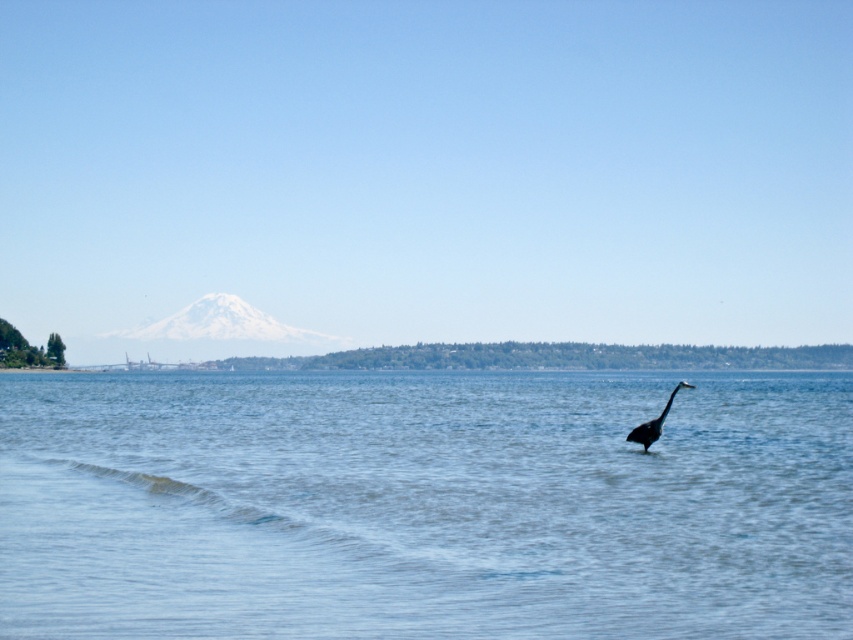
Question: Is clear blue water at center in front of gray matte bird at center?

Choices:
 (A) yes
 (B) no

Answer: (A)

Question: Can you confirm if clear blue water at center is positioned above gray matte bird at center?

Choices:
 (A) yes
 (B) no

Answer: (B)

Question: Which object appears farthest from the camera in this image?

Choices:
 (A) gray matte bird at center
 (B) clear blue water at center

Answer: (A)

Question: Which point is closer to the camera?

Choices:
 (A) clear blue water at center
 (B) gray matte bird at center

Answer: (A)

Question: Is clear blue water at center positioned in front of gray matte bird at center?

Choices:
 (A) yes
 (B) no

Answer: (A)

Question: Among these points, which one is nearest to the camera?

Choices:
 (A) (685, 381)
 (B) (846, 620)

Answer: (B)